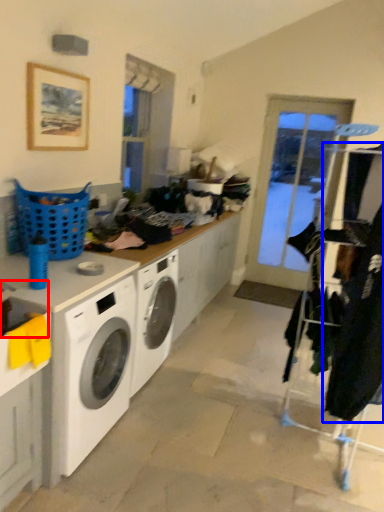
Question: Which point is further to the camera, sink (highlighted by a red box) or clothing (highlighted by a blue box)?

Choices:
 (A) sink
 (B) clothing

Answer: (B)